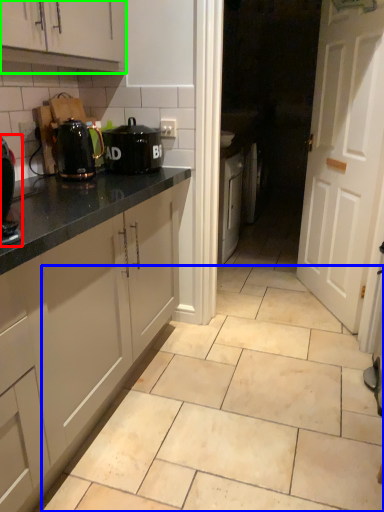
Question: Which object is the closest to the coffee machine (highlighted by a red box)? Choose among these: ceramic tile (highlighted by a blue box) or cabinetry (highlighted by a green box).

Choices:
 (A) ceramic tile
 (B) cabinetry

Answer: (B)